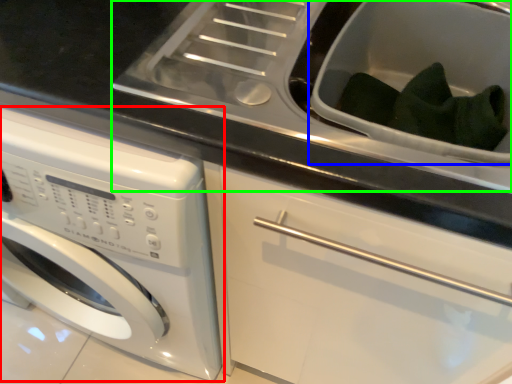
Question: Based on their relative distances, which object is nearer to washing machine (highlighted by a red box)? Choose from sink (highlighted by a blue box) and sink (highlighted by a green box).

Choices:
 (A) sink
 (B) sink

Answer: (B)